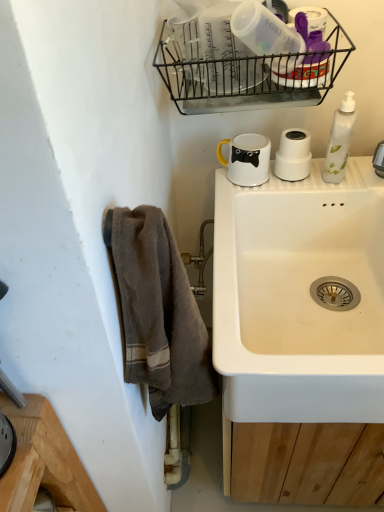
Locate an element on the screen. free location in front of white matte cup at upper right, which is counted as the 2th appliance, starting from the left is located at coordinates (292, 190).